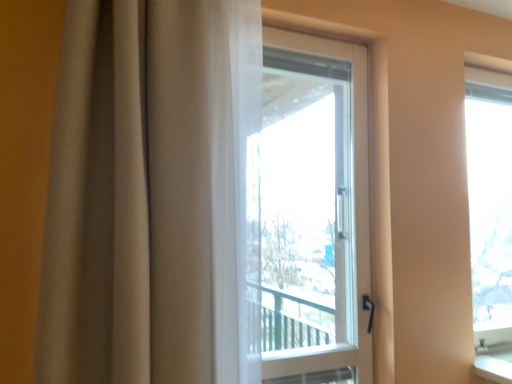
What do you see at coordinates (151, 195) in the screenshot? I see `white sheer curtain at center` at bounding box center [151, 195].

Locate an element on the screen. The image size is (512, 384). white sheer curtain at center is located at coordinates (151, 195).

The width and height of the screenshot is (512, 384). What are the coordinates of `white sheer curtain at center` in the screenshot? It's located at (151, 195).